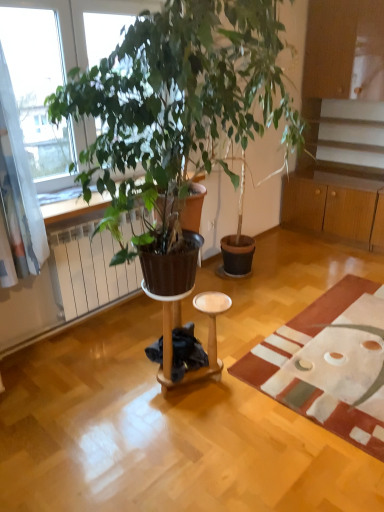
Question: Considering the positions of wooden side table at center and wooden cabinet at right in the image, is wooden side table at center bigger or smaller than wooden cabinet at right?

Choices:
 (A) small
 (B) big

Answer: (A)

Question: Choose the correct answer: Is wooden side table at center inside wooden cabinet at right or outside it?

Choices:
 (A) outside
 (B) inside

Answer: (A)

Question: Estimate the real-world distances between objects in this image. Which object is farther from the brown matte radiator at left?

Choices:
 (A) wooden side table at center
 (B) textured beige rug at lower right
 (C) wooden cabinet at right

Answer: (C)

Question: Based on their relative distances, which object is nearer to the wooden side table at center?

Choices:
 (A) wooden cabinet at right
 (B) textured beige rug at lower right
 (C) brown matte radiator at left

Answer: (B)